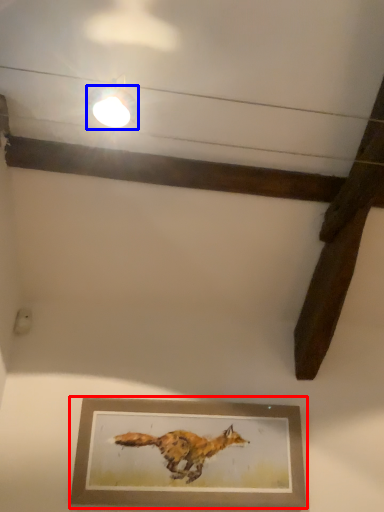
Question: Among these objects, which one is nearest to the camera, picture frame (highlighted by a red box) or light fixture (highlighted by a blue box)?

Choices:
 (A) picture frame
 (B) light fixture

Answer: (B)